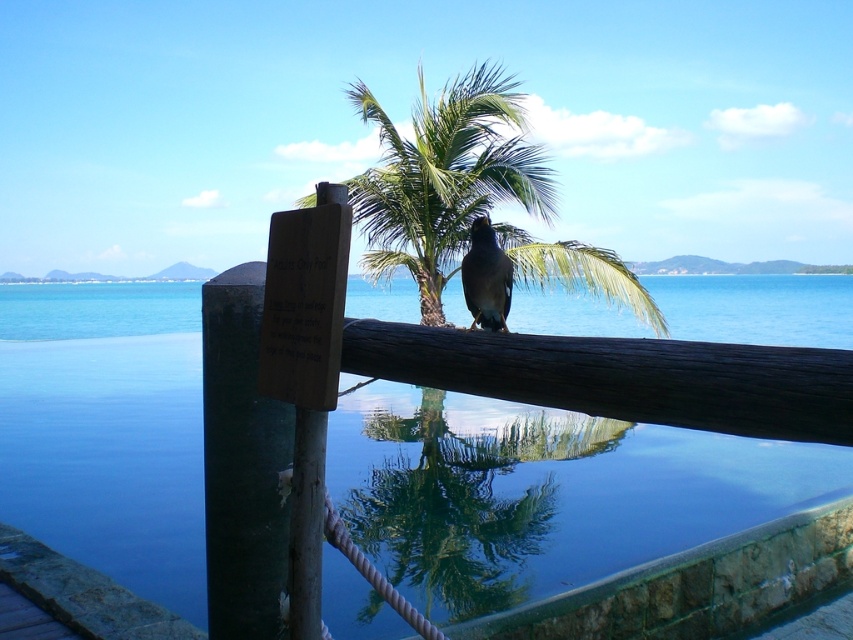
What are the coordinates of the transparent glass water at center?

The transparent glass water at center is located at point (544, 492).

You are a photographer aiming to capture the shiny brown bird at center without the transparent glass water at center obstructing the view. Is it possible to adjust your position so that the bird is fully visible without any water in the frame?

The transparent glass water at center is positioned over shiny brown bird at center, so adjusting your position might allow you to angle the camera to capture the bird without the water obstructing it, but since the water is above the bird, it may still partially block the view depending on the angle.